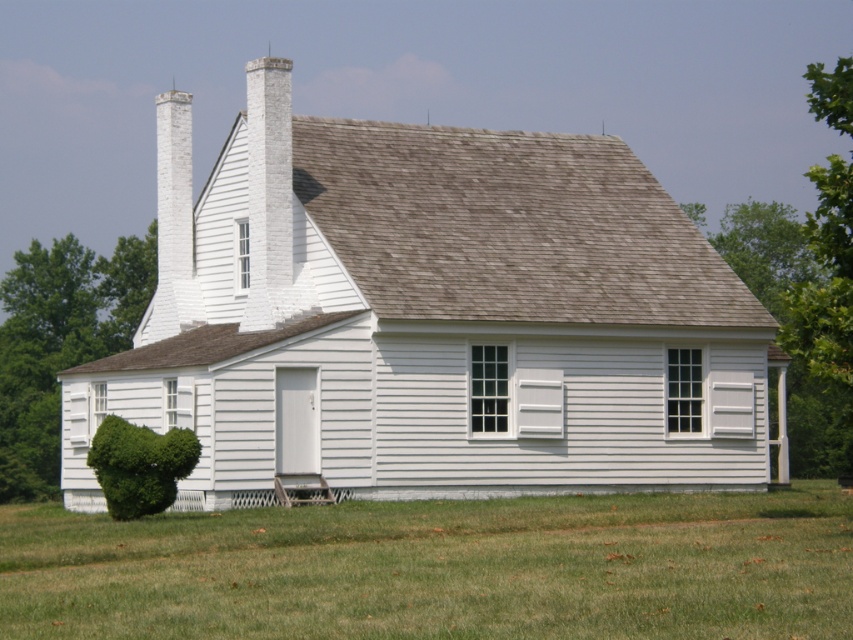
Is green grass at lower center shorter than green leafy bush at lower left?

Yes.

Looking at this image, between green grass at lower center and green leafy bush at lower left, which one is positioned lower?

green grass at lower center is lower down.

Which is behind, point (776, 620) or point (33, 417)?

Point (33, 417)

Locate an element on the screen. green grass at lower center is located at coordinates (440, 568).